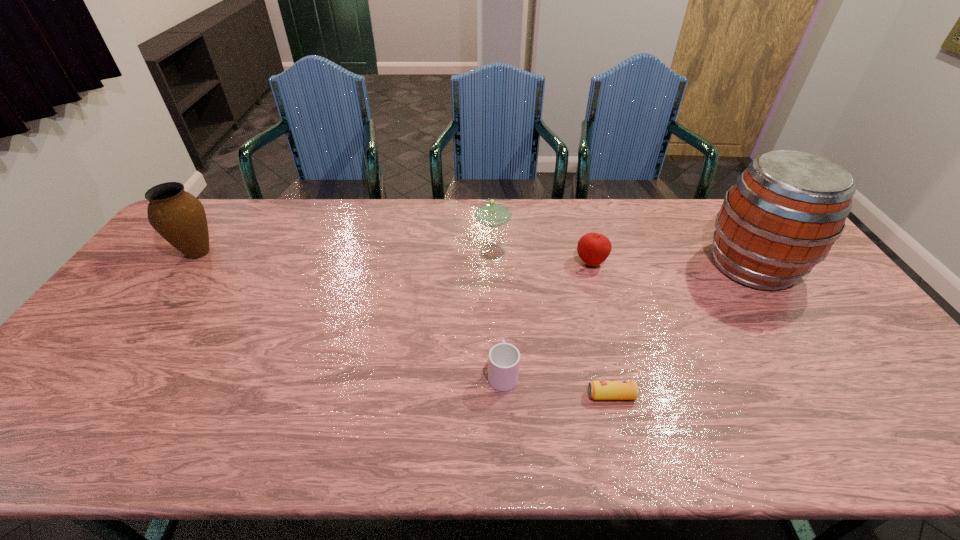
The width and height of the screenshot is (960, 540). In order to click on free location that satisfies the following two spatial constraints: 1. with the handle on the side of the tallest object; 2. on the left side of the cup in this screenshot , I will do pos(498,265).

This screenshot has height=540, width=960. I want to click on free spot that satisfies the following two spatial constraints: 1. with the handle on the side of the apple; 2. on the right side of the cup, so click(x=498, y=262).

Identify the location of vacant space that satisfies the following two spatial constraints: 1. with the handle on the side of the apple; 2. on the left side of the cup. This screenshot has height=540, width=960. (498, 262).

At what (x,y) coordinates should I click in order to perform the action: click on free region that satisfies the following two spatial constraints: 1. on the front side of the martini; 2. on the right side of the shortest object. Please return your answer as a coordinate pair (x, y). Looking at the image, I should click on (501, 395).